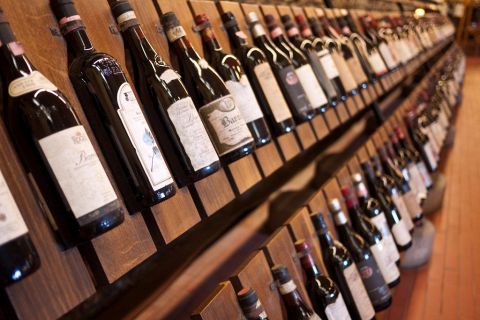
Where is `wooden shelf panels`? This screenshot has height=320, width=480. wooden shelf panels is located at coordinates (419, 297), (402, 296), (436, 293), (451, 293), (463, 292), (478, 269).